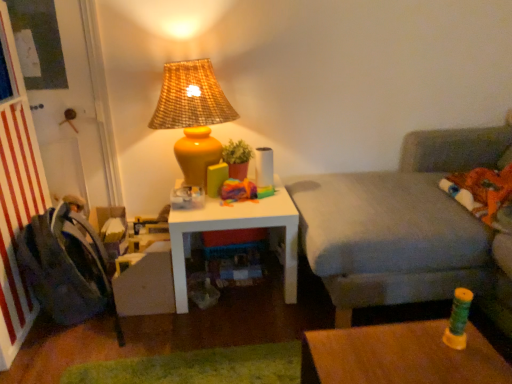
Question: Should I look upward or downward to see dark gray fabric swivel chair at left?

Choices:
 (A) up
 (B) down

Answer: (B)

Question: Should I look upward or downward to see white matte table at center?

Choices:
 (A) down
 (B) up

Answer: (A)

Question: From the image's perspective, is matte yellow vase at upper center below gray fabric couch at right?

Choices:
 (A) no
 (B) yes

Answer: (A)

Question: Are matte yellow vase at upper center and gray fabric couch at right beside each other?

Choices:
 (A) yes
 (B) no

Answer: (B)

Question: Is matte yellow vase at upper center outside of gray fabric couch at right?

Choices:
 (A) no
 (B) yes

Answer: (B)

Question: From a real-world perspective, is matte yellow vase at upper center under gray fabric couch at right?

Choices:
 (A) yes
 (B) no

Answer: (B)

Question: Does matte yellow vase at upper center contain gray fabric couch at right?

Choices:
 (A) yes
 (B) no

Answer: (B)

Question: Is matte yellow vase at upper center thinner than gray fabric couch at right?

Choices:
 (A) no
 (B) yes

Answer: (B)

Question: Can you confirm if white matte table at center is taller than dark gray fabric swivel chair at left?

Choices:
 (A) no
 (B) yes

Answer: (A)

Question: Does white matte table at center have a lesser width compared to dark gray fabric swivel chair at left?

Choices:
 (A) no
 (B) yes

Answer: (A)

Question: Considering the relative sizes of white matte table at center and dark gray fabric swivel chair at left in the image provided, is white matte table at center smaller than dark gray fabric swivel chair at left?

Choices:
 (A) no
 (B) yes

Answer: (A)

Question: Are white matte table at center and dark gray fabric swivel chair at left located far from each other?

Choices:
 (A) no
 (B) yes

Answer: (A)

Question: Does white matte table at center have a lesser height compared to dark gray fabric swivel chair at left?

Choices:
 (A) no
 (B) yes

Answer: (B)

Question: Does white matte table at center turn towards dark gray fabric swivel chair at left?

Choices:
 (A) no
 (B) yes

Answer: (A)

Question: Is matte yellow vase at upper center at the left side of white matte table at center?

Choices:
 (A) yes
 (B) no

Answer: (A)